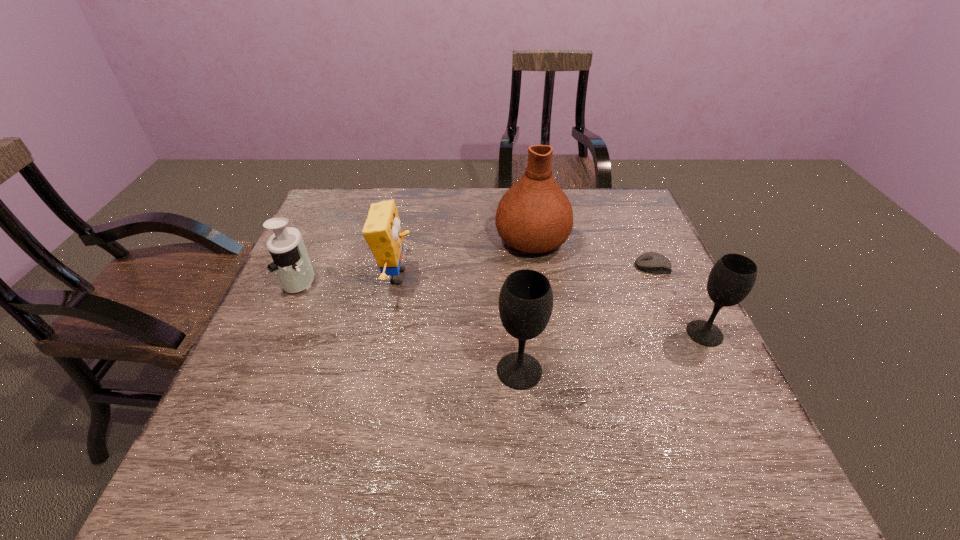
You are a GUI agent. You are given a task and a screenshot of the screen. Output one action in this format:
    pyautogui.click(x=<x>, y=<y>)
    Task: Click on the free space located 0.110m on the side of the pitcher with the handle
    The image size is (960, 540).
    Given the screenshot: What is the action you would take?
    pyautogui.click(x=526, y=197)

What are the coordinates of `vacant region located 0.080m on the right of the leftmost object` in the screenshot? It's located at pyautogui.click(x=346, y=280).

Where is `free location located on the face of the fifth object from right to left`? The height and width of the screenshot is (540, 960). free location located on the face of the fifth object from right to left is located at coordinates (536, 277).

Where is `vacant space located 0.130m on the back of the shortest object`? The width and height of the screenshot is (960, 540). vacant space located 0.130m on the back of the shortest object is located at coordinates (637, 232).

Identify the location of object at the far edge. The height and width of the screenshot is (540, 960). (534, 216).

This screenshot has height=540, width=960. Identify the location of object that is at the left edge. (291, 262).

At what (x,y) coordinates should I click in order to perform the action: click on wineglass present at the right edge. Please return your answer as a coordinate pair (x, y). Image resolution: width=960 pixels, height=540 pixels. Looking at the image, I should click on tap(733, 276).

Find the location of `computer equipment at the right edge`. computer equipment at the right edge is located at coordinates (651, 262).

Find the location of a particular element. vacant space at the far edge of the desktop is located at coordinates (387, 188).

The width and height of the screenshot is (960, 540). Find the location of `free space at the near edge`. free space at the near edge is located at coordinates (567, 433).